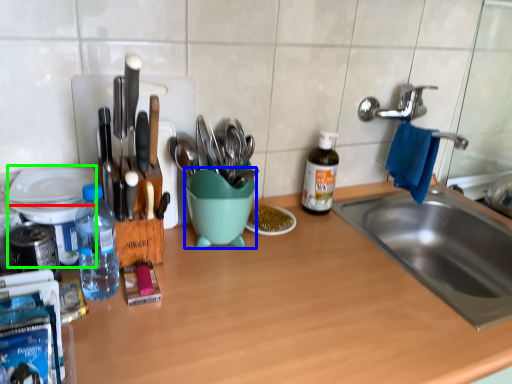
Question: Which object is positioned farthest from plate (highlighted by a red box)? Select from mixing bowl (highlighted by a blue box) and appliance (highlighted by a green box).

Choices:
 (A) mixing bowl
 (B) appliance

Answer: (A)